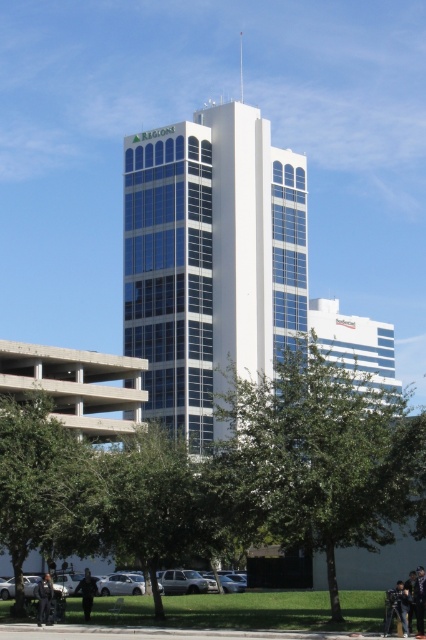
Question: Is black leather jacket at lower left to the right of dark gray jacket at lower left from the viewer's perspective?

Choices:
 (A) yes
 (B) no

Answer: (B)

Question: Is green leafy tree at center smaller than dark gray jacket at lower left?

Choices:
 (A) no
 (B) yes

Answer: (A)

Question: In this image, where is white glass building at center located relative to black leather jacket at lower center?

Choices:
 (A) below
 (B) above

Answer: (B)

Question: Among these objects, which one is nearest to the camera?

Choices:
 (A) black leather jacket at lower left
 (B) green leafy tree at lower left

Answer: (B)

Question: Among these objects, which one is nearest to the camera?

Choices:
 (A) dark blue jeans at lower center
 (B) green leafy tree at center
 (C) dark gray jacket at lower left
 (D) green leafy tree at lower center

Answer: (A)

Question: Based on their relative distances, which object is farther from the dark gray jacket at lower left?

Choices:
 (A) green leafy tree at lower center
 (B) black leather jacket at lower left

Answer: (A)